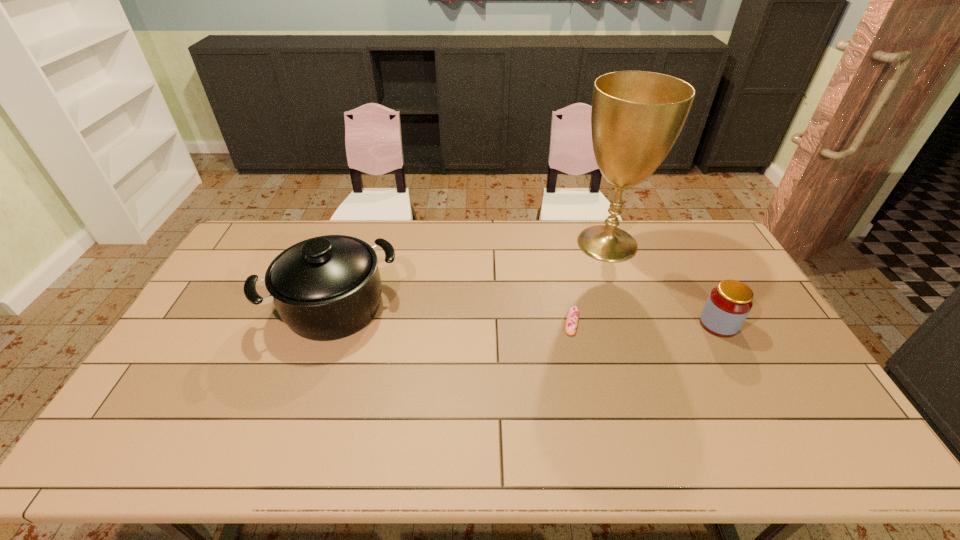
Where is `vacant space that's between the eclair and the rightmost object`? The width and height of the screenshot is (960, 540). vacant space that's between the eclair and the rightmost object is located at coordinates (645, 323).

I want to click on unoccupied area between the saucepan and the third object from right to left, so click(x=453, y=314).

At what (x,y) coordinates should I click in order to perform the action: click on empty space that is in between the second object from left to right and the jar. Please return your answer as a coordinate pair (x, y). This screenshot has height=540, width=960. Looking at the image, I should click on (645, 323).

Find the location of a particular element. The height and width of the screenshot is (540, 960). vacant area that lies between the shortest object and the second object from right to left is located at coordinates (589, 283).

At what (x,y) coordinates should I click in order to perform the action: click on blank region between the shortest object and the tallest object. Please return your answer as a coordinate pair (x, y). Looking at the image, I should click on (589, 283).

Image resolution: width=960 pixels, height=540 pixels. What are the coordinates of `vacant area between the leftmost object and the eclair` in the screenshot? It's located at (453, 314).

Find the location of `free point between the saucepan and the trophy cup`. free point between the saucepan and the trophy cup is located at coordinates (470, 275).

Locate an element on the screen. unoccupied area between the third object from right to left and the farthest object is located at coordinates (589, 283).

The image size is (960, 540). I want to click on vacant region between the saucepan and the second object from left to right, so click(x=453, y=314).

Where is `object that stands as the third closest to the second object from right to left`? The height and width of the screenshot is (540, 960). object that stands as the third closest to the second object from right to left is located at coordinates (325, 288).